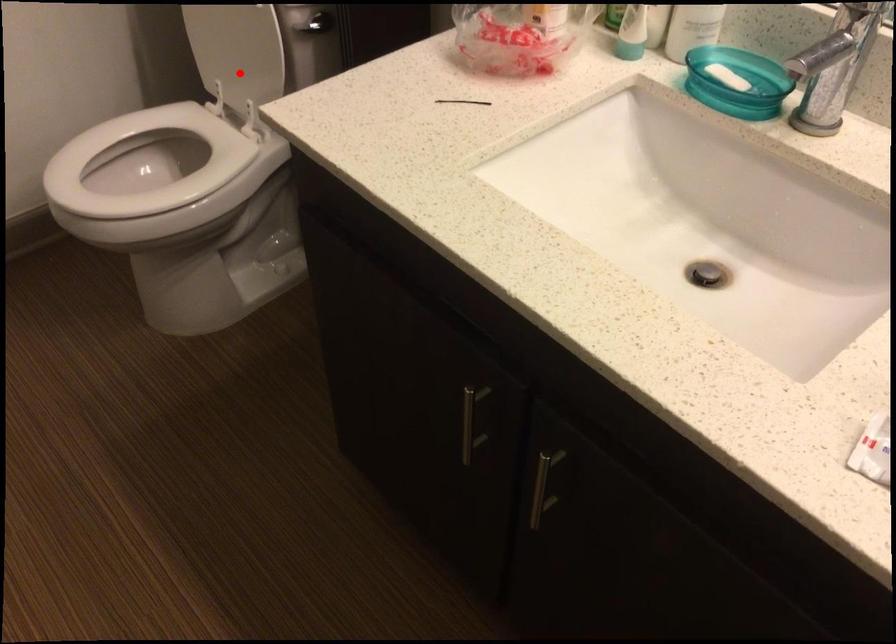
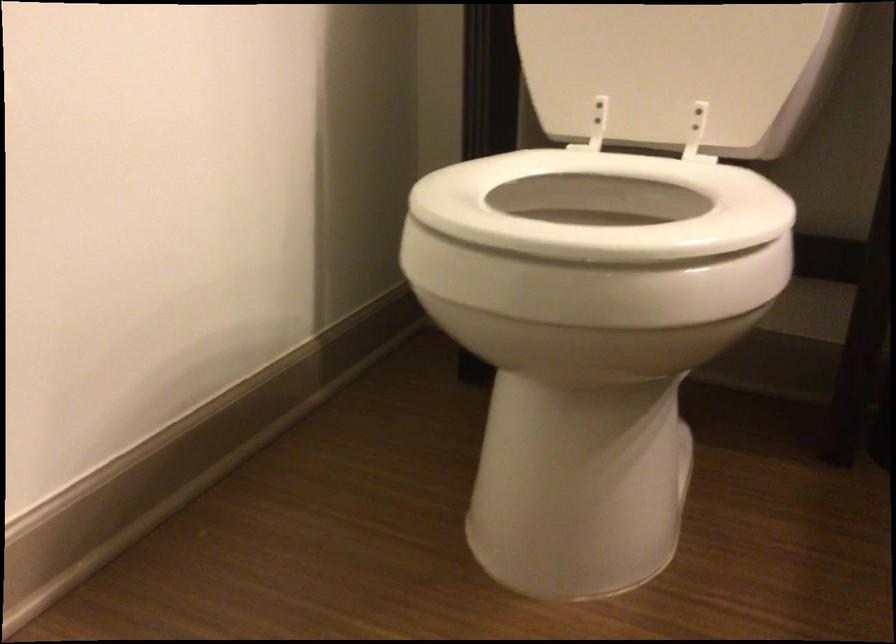
Question: I am providing you with two images of the same scene from different viewpoints. Image1 has a red point marked. In image2, the corresponding 3D location appears at what relative position? Reply with the corresponding letter.

Choices:
 (A) Closer
 (B) Farther

Answer: (A)